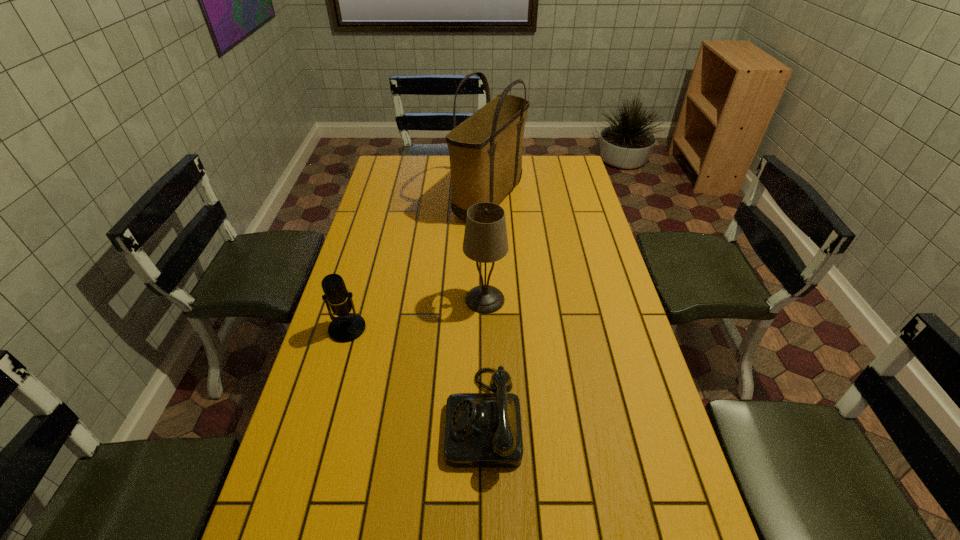
Find the location of a particular element. This screenshot has width=960, height=540. vacant space at the right edge is located at coordinates (598, 281).

Locate an element on the screen. The height and width of the screenshot is (540, 960). vacant space at the far left corner of the desktop is located at coordinates (381, 168).

At what (x,y) coordinates should I click in order to perform the action: click on free space between the third tallest object and the lampshade. Please return your answer as a coordinate pair (x, y). Looking at the image, I should click on (416, 314).

This screenshot has height=540, width=960. Identify the location of free space between the second farthest object and the microphone. (416, 314).

Locate an element on the screen. free spot between the leftmost object and the shortest object is located at coordinates (415, 373).

Identify the location of free space between the nearest object and the second tallest object. This screenshot has height=540, width=960. (484, 358).

The height and width of the screenshot is (540, 960). I want to click on free spot between the nearest object and the leftmost object, so click(415, 373).

Point out which object is positioned as the second nearest to the telephone. Please provide its 2D coordinates. Your answer should be formatted as a tuple, i.e. [(x, y)], where the tuple contains the x and y coordinates of a point satisfying the conditions above.

[(346, 327)]

This screenshot has height=540, width=960. I want to click on the closest object to the microphone, so (x=482, y=430).

The height and width of the screenshot is (540, 960). Identify the location of free spot that satisfies the following two spatial constraints: 1. on the front side of the farthest object; 2. on the dial of the telephone. (495, 417).